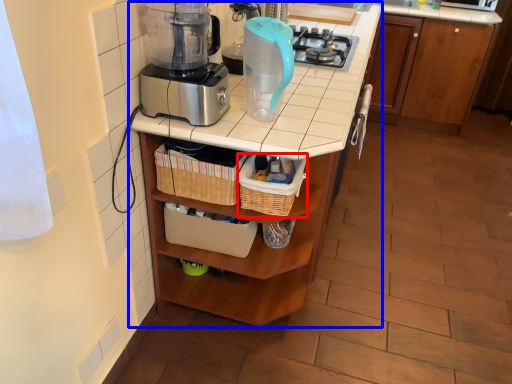
Question: Which of the following is the closest to the observer, basket (highlighted by a red box) or table (highlighted by a blue box)?

Choices:
 (A) basket
 (B) table

Answer: (B)